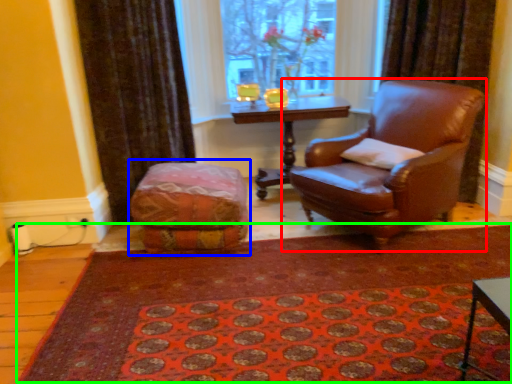
Question: Considering the real-world distances, which object is closest to chair (highlighted by a red box)? bean bag chair (highlighted by a blue box) or doormat (highlighted by a green box).

Choices:
 (A) bean bag chair
 (B) doormat

Answer: (B)